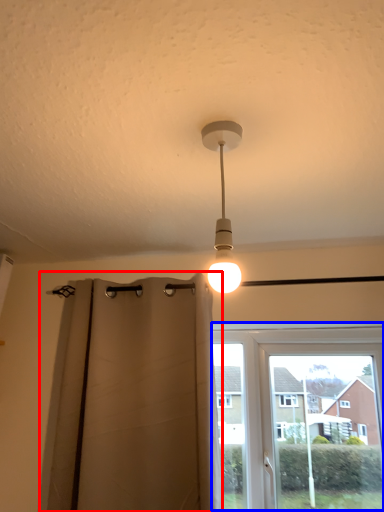
Question: Which of the following is the farthest to the observer, curtain (highlighted by a red box) or window (highlighted by a blue box)?

Choices:
 (A) curtain
 (B) window

Answer: (B)